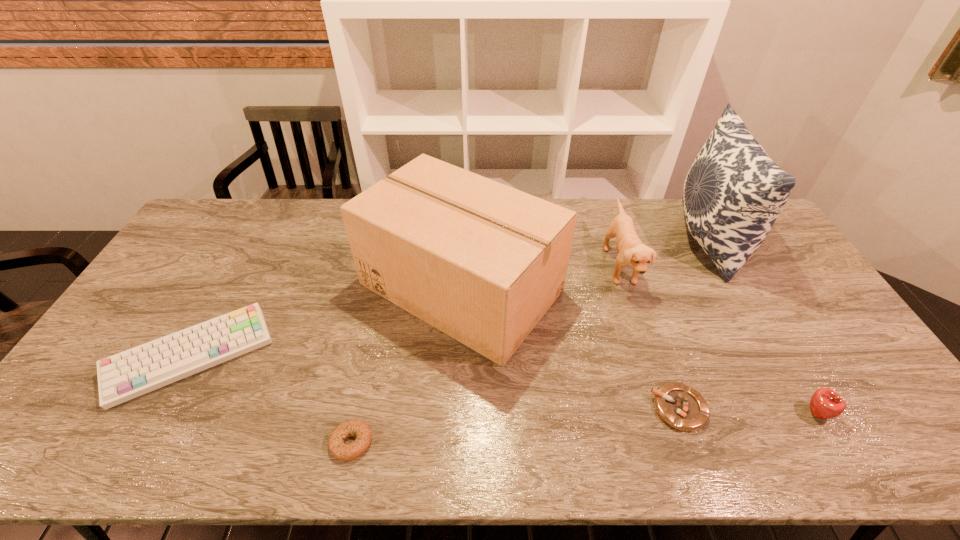
The image size is (960, 540). In the image, there is a desktop. Find the location of `vacant space at the right edge`. vacant space at the right edge is located at coordinates (866, 376).

Identify the location of vacant space at the far left corner. (228, 230).

In the image, there is a desktop. At what (x,y) coordinates should I click in order to perform the action: click on vacant space at the near right corner. Please return your answer as a coordinate pair (x, y). The image size is (960, 540). Looking at the image, I should click on (915, 435).

Locate an element on the screen. The width and height of the screenshot is (960, 540). unoccupied area between the box and the bagel is located at coordinates (406, 365).

At what (x,y) coordinates should I click in order to perform the action: click on free spot between the computer keyboard and the fourth shortest object. Please return your answer as a coordinate pair (x, y). Looking at the image, I should click on [504, 385].

You are a GUI agent. You are given a task and a screenshot of the screen. Output one action in this format:
    pyautogui.click(x=<x>, y=<y>)
    Task: Click on the empty space that is in between the tallest object and the ashtray
    
    Given the screenshot: What is the action you would take?
    pyautogui.click(x=693, y=325)

The image size is (960, 540). I want to click on empty space that is in between the ashtray and the bagel, so click(x=515, y=426).

Where is `free space between the tallest object and the ashtray`? Image resolution: width=960 pixels, height=540 pixels. free space between the tallest object and the ashtray is located at coordinates (693, 325).

Identify the location of empty space that is in between the apple and the third shortest object. The image size is (960, 540). (504, 385).

I want to click on free space between the tallest object and the box, so click(x=585, y=264).